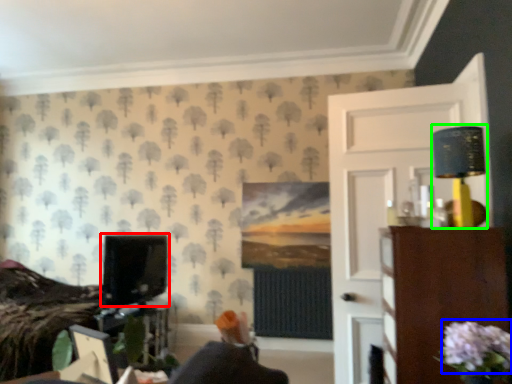
Question: Which object is the closest to the computer monitor (highlighted by a red box)? Choose among these: flower (highlighted by a blue box) or table lamp (highlighted by a green box).

Choices:
 (A) flower
 (B) table lamp

Answer: (B)